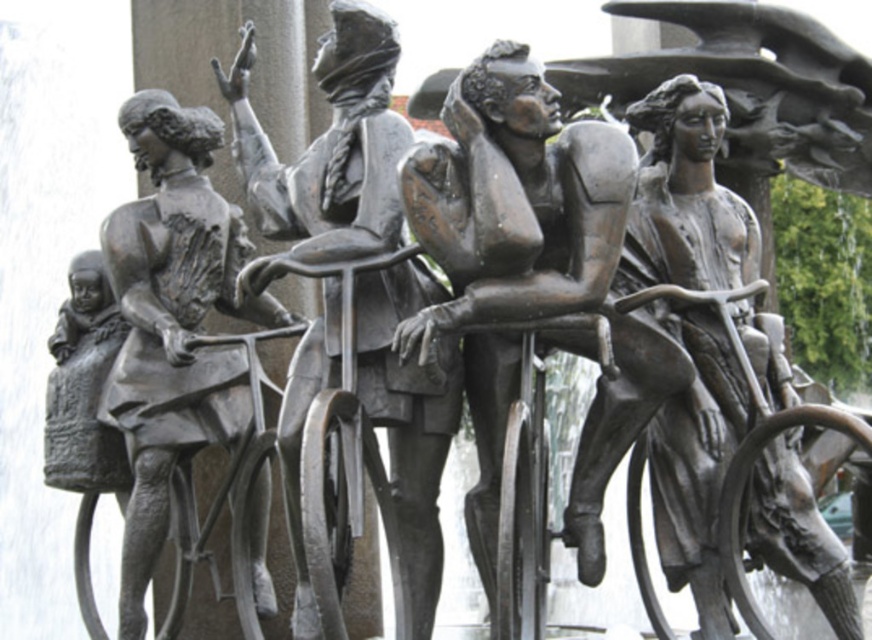
You are standing at the base of the bronze sculpture and want to take a photo of the point at coordinates (485, 308). If your camera has a maximum focus range of 50 meters, will it be able to capture the point clearly?

The point at coordinates (485, 308) is 52.04 meters away from the viewer. Since the camera can only focus up to 50 meters, it will not be able to capture the point clearly.

You are an artist planning to create a miniature version of the sculpture group. You need to ensure that the proportions between the polished bronze bicycle at center and the bronze statue of person at left remain accurate. Which object should you scale down more to maintain the correct size relationship?

The polished bronze bicycle at center should be scaled down more because its width is larger than the bronze statue of person at left, so reducing it proportionally will preserve the size relationship.